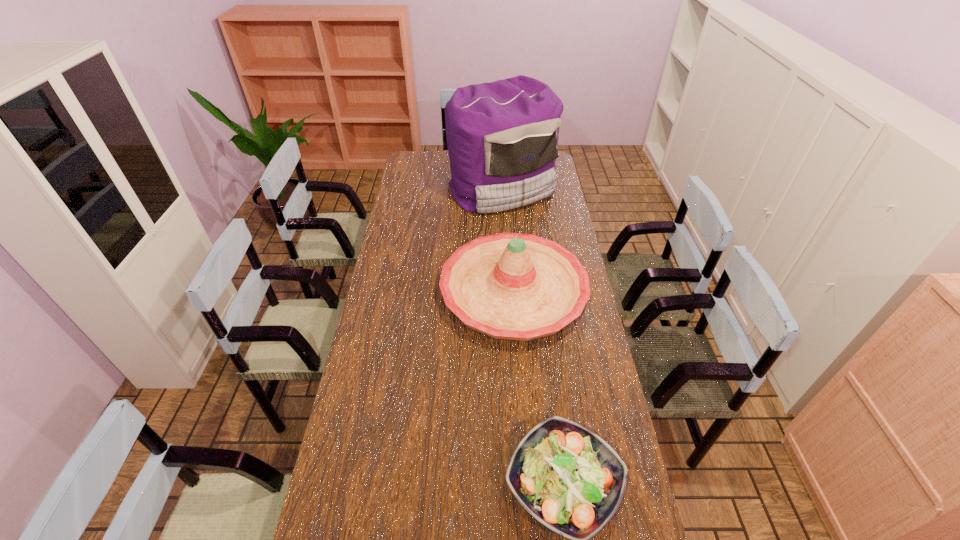
Where is `vacant space at the left edge`? vacant space at the left edge is located at coordinates (400, 244).

This screenshot has height=540, width=960. In order to click on blank space at the right edge in this screenshot , I will do tap(607, 427).

Identify the location of object that can be found as the second closest to the second tallest object. Image resolution: width=960 pixels, height=540 pixels. (568, 478).

Find the location of a particular element. This screenshot has width=960, height=540. object that is the nearest to the nearest object is located at coordinates point(512,286).

This screenshot has width=960, height=540. I want to click on vacant area in the image that satisfies the following two spatial constraints: 1. on the front pocket of the backpack; 2. on the right side of the second tallest object, so click(509, 292).

Where is `free point that satisfies the following two spatial constraints: 1. on the front pocket of the farthest object; 2. on the left side of the sombrero`? The height and width of the screenshot is (540, 960). free point that satisfies the following two spatial constraints: 1. on the front pocket of the farthest object; 2. on the left side of the sombrero is located at coordinates (509, 292).